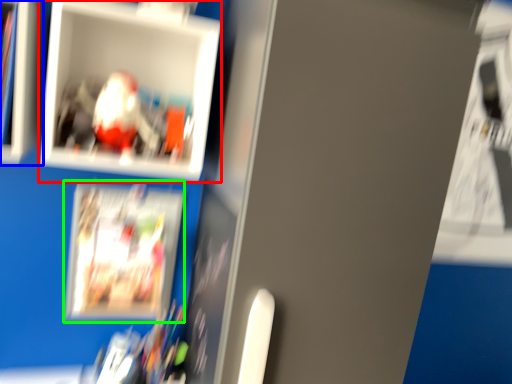
Question: Which object is the farthest from picture frame (highlighted by a red box)? Choose among these: cabinet (highlighted by a blue box) or magazine (highlighted by a green box).

Choices:
 (A) cabinet
 (B) magazine

Answer: (B)